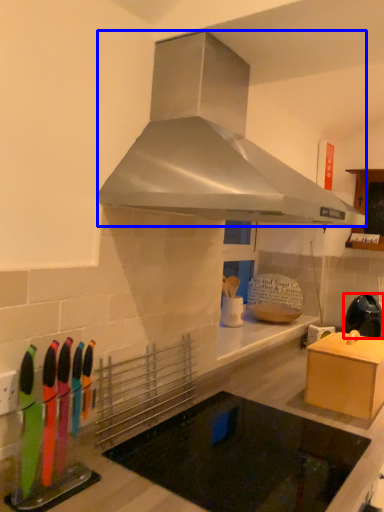
Question: Which point is further to the camera, kitchen appliance (highlighted by a red box) or home appliance (highlighted by a blue box)?

Choices:
 (A) kitchen appliance
 (B) home appliance

Answer: (A)